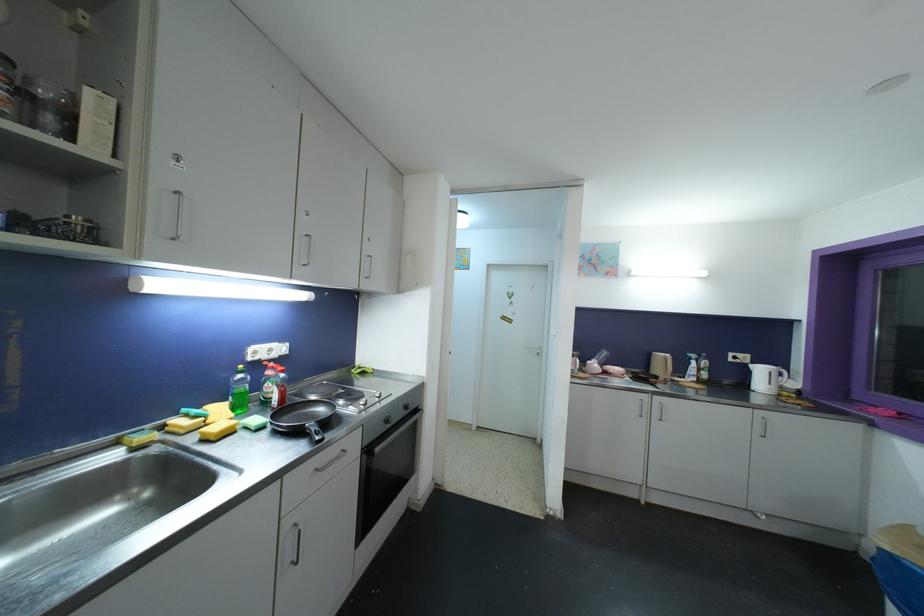
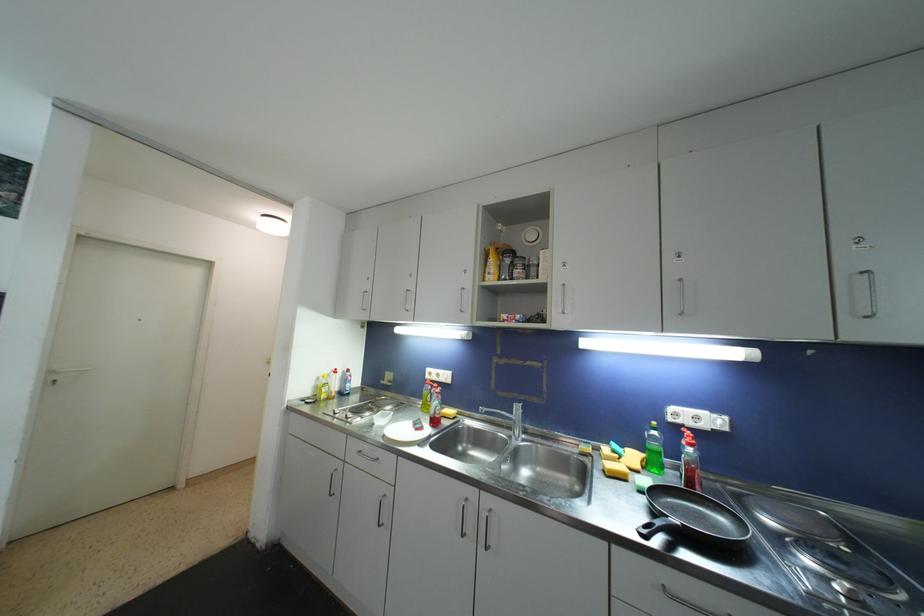
The point at [244,379] is marked in the first image. Where is the corresponding point in the second image?

(658, 436)